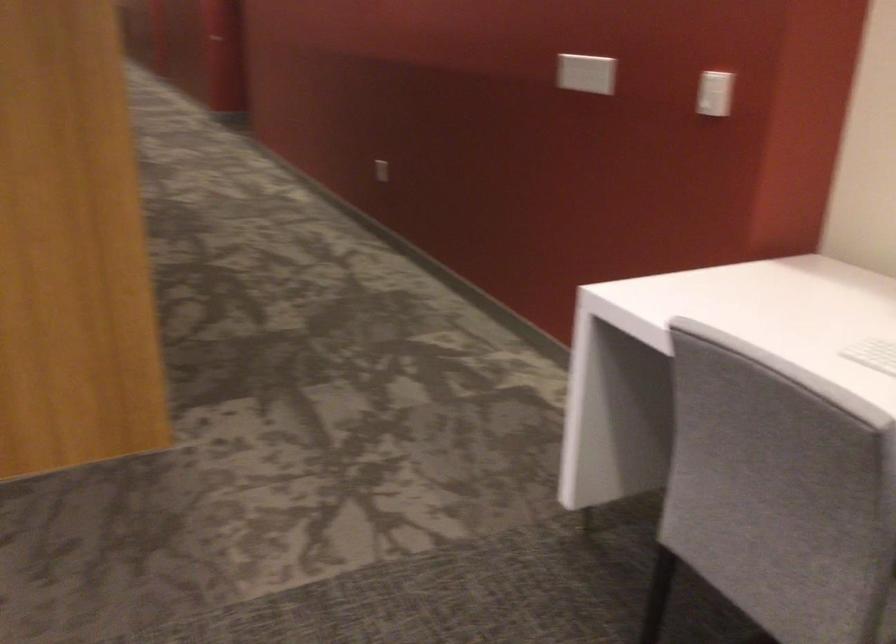
How did the camera likely rotate?

The camera's rotation is toward left-down.